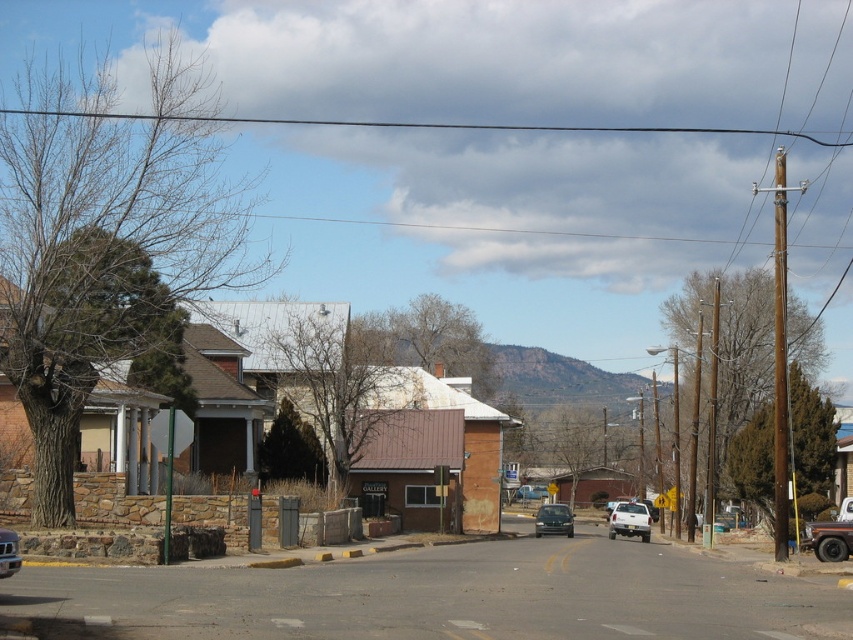
You are a delivery driver trying to park your 6 meter long truck in this street. The truck requires a space at least 6 meters long. Looking at the scene, can you determine if the space between the brown stone building at center and the satin black sedan at center is long enough for your truck?

The brown stone building at center is larger in size compared to the satin black sedan at center, but the exact distance between them isn not specified. Therefore, it is uncertain whether the space is sufficient for a 6 meter truck.